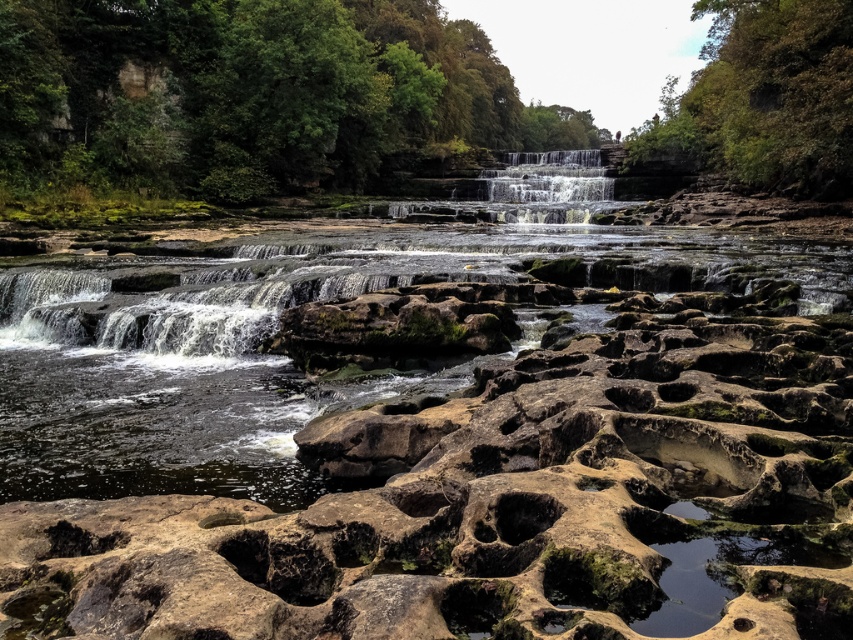
You are standing at the edge of the scene and want to locate the brown rock river at center. Based on the coordinates provided, can you determine its position relative to the center of the image?

The brown rock river at center is located at coordinates point (271, 333), which is slightly to the right and above the exact center of the image.

You are standing at the edge of the scene and want to locate the brown rock river at center. Which direction should you look to find it?

You should look towards the center of the scene to find the brown rock river at center, as it is located at point coordinates approximately 0.522 on the x axis and 0.319 on the y axis.

Based on the photo, you are a hiker who wants to cross the brown rock river at center. You notice the green leafy tree at upper center nearby. Which object is smaller in size between them?

The brown rock river at center has a smaller size compared to the green leafy tree at upper center, so the brown rock river at center is the smaller one.